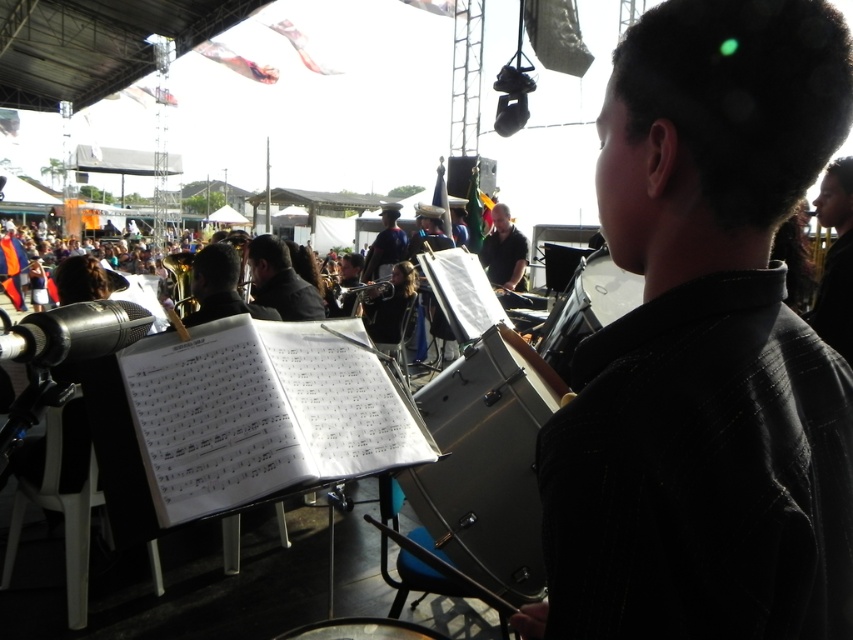
You are a photographer taking pictures of the metallic drum at center and the gold brass tuba at center. Which instrument should you adjust your camera to focus on first if you want to capture both in the same frame without moving your position?

You should focus on the gold brass tuba at center first since the metallic drum at center is positioned to the right of it, allowing both instruments to be captured in the same frame by adjusting the camera angle slightly to the right.